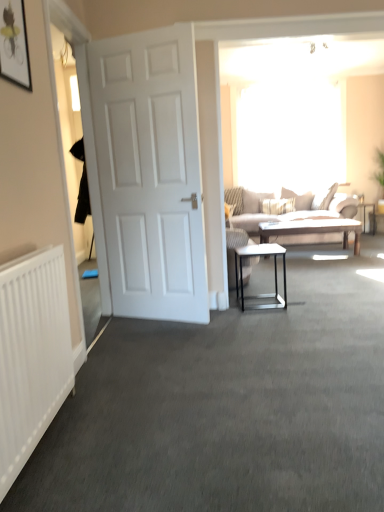
Question: Is point (261, 303) positioned closer to the camera than point (28, 377)?

Choices:
 (A) farther
 (B) closer

Answer: (A)

Question: Is white glossy side table at center situated inside white textured radiator at left or outside?

Choices:
 (A) outside
 (B) inside

Answer: (A)

Question: Which is farther from the matte black picture frame at upper left?

Choices:
 (A) white glossy side table at center
 (B) white textured radiator at left
 (C) beige fabric couch at center
 (D) metallic silver side table at right
 (E) transparent glass window at upper center

Answer: (D)

Question: Estimate the real-world distances between objects in this image. Which object is farther from the transparent glass window at upper center?

Choices:
 (A) beige fabric couch at center
 (B) metallic silver side table at right
 (C) white glossy side table at center
 (D) white matte door at left
 (E) white textured radiator at left

Answer: (E)